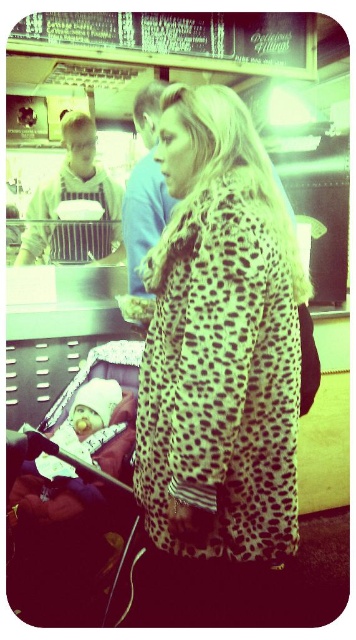
You are a delivery robot that needs to navigate to the counter at the back of the deli. You are currently positioned at the camera location. The leopard print coat at center is blocking your path. Can you safely move around it to reach the counter?

The leopard print coat at center is 1.01 meters away from the camera, so the robot can safely move around it to reach the counter as the distance allows for maneuvering space.

You are standing in a deli and want to reach a menu item located at point (279, 365). Your arm can extend 1.2 meters. Can you reach it?

The point (279, 365) is 1.17 meters away from the viewer, so yes, you can reach it since your arm can extend 1.2 meters.